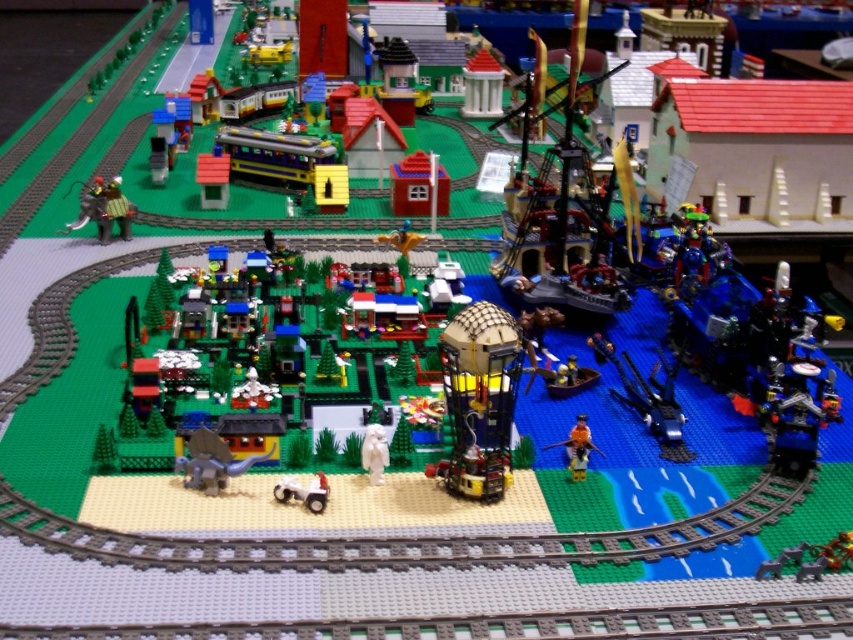
Question: Which of the following is the closest to the observer?

Choices:
 (A) metallic yellow train at center
 (B) white matte figure at center

Answer: (B)

Question: Can you confirm if translucent yellow/golden metallic sphere at center is positioned above orange matte figure at center?

Choices:
 (A) yes
 (B) no

Answer: (A)

Question: Which object is farther from the camera taking this photo?

Choices:
 (A) white matte car at center
 (B) translucent yellow/golden metallic sphere at center
 (C) smooth gray dinosaur at center

Answer: (C)

Question: Does shiny silver sword at upper left have a lesser width compared to white matte car at center?

Choices:
 (A) yes
 (B) no

Answer: (B)

Question: Which point is closer to the camera?

Choices:
 (A) metallic yellow train at center
 (B) translucent yellow/golden metallic sphere at center

Answer: (B)

Question: Does metallic yellow train at center have a smaller size compared to orange matte figure at center?

Choices:
 (A) no
 (B) yes

Answer: (A)